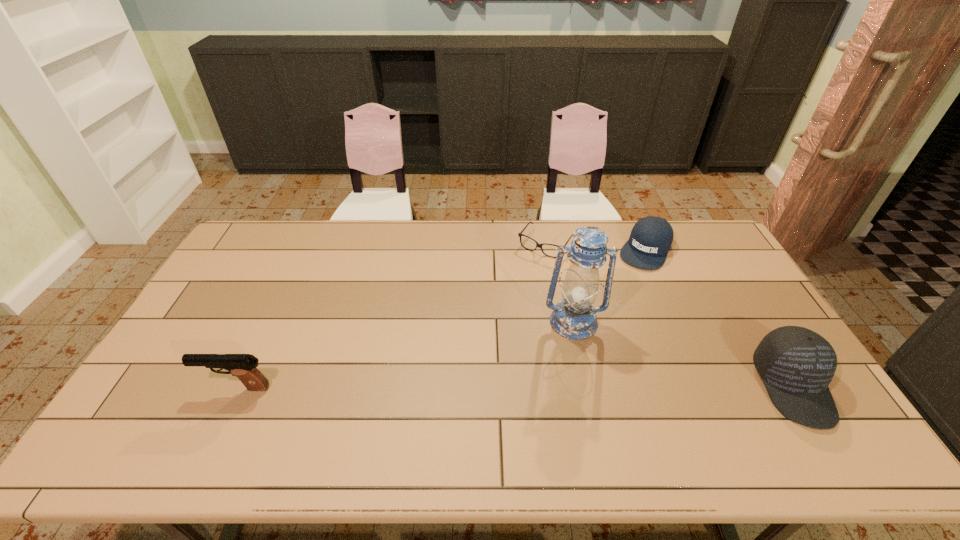
You are a GUI agent. You are given a task and a screenshot of the screen. Output one action in this format:
    pyautogui.click(x=<x>, y=<y>)
    Task: Click on the pistol
    Image resolution: width=960 pixels, height=540 pixels.
    Given the screenshot: What is the action you would take?
    pyautogui.click(x=243, y=366)

Find the location of a particular element. This screenshot has height=540, width=960. the rightmost object is located at coordinates (796, 364).

The width and height of the screenshot is (960, 540). Identify the location of the taller baseball cap. (796, 364).

I want to click on the fourth object from left to right, so click(650, 239).

Where is `the left baseball cap`? Image resolution: width=960 pixels, height=540 pixels. the left baseball cap is located at coordinates (650, 239).

This screenshot has width=960, height=540. Find the location of `the tallest object`. the tallest object is located at coordinates (574, 317).

Locate an element on the screen. This screenshot has height=540, width=960. the third nearest object is located at coordinates [574, 317].

Identify the location of the shortest object. (520, 234).

Locate an element on the screen. This screenshot has width=960, height=540. free region located 0.140m at the barrel of the pistol is located at coordinates click(x=151, y=388).

Locate an element on the screen. Image resolution: width=960 pixels, height=540 pixels. free space located 0.090m at the barrel of the pistol is located at coordinates (170, 388).